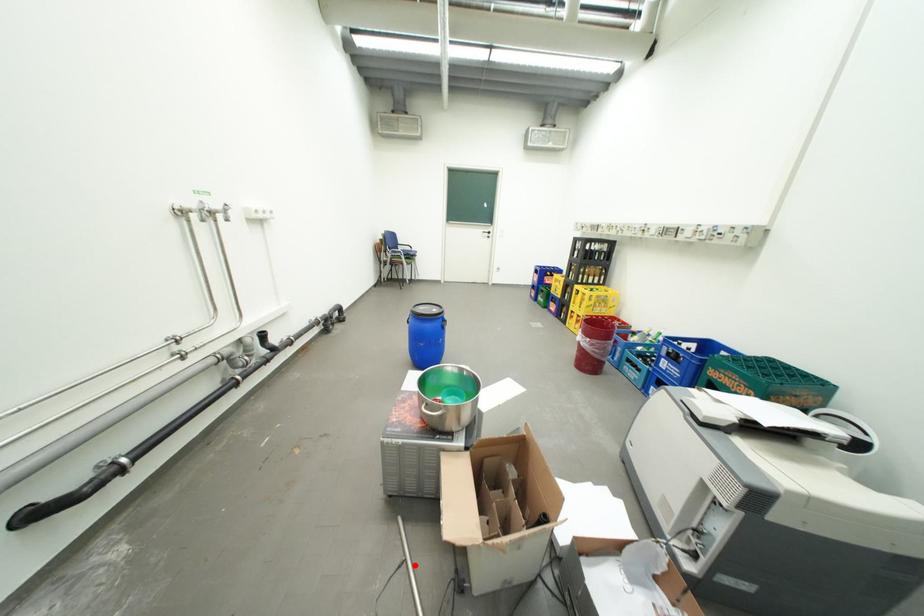
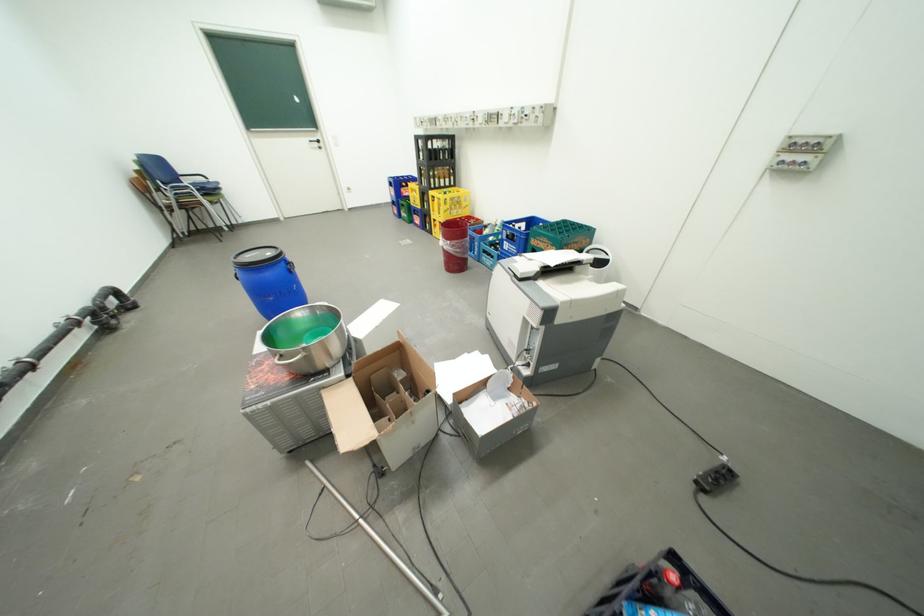
The point at the highlighted location is marked in the first image. Where is the corresponding point in the second image?

(334, 492)